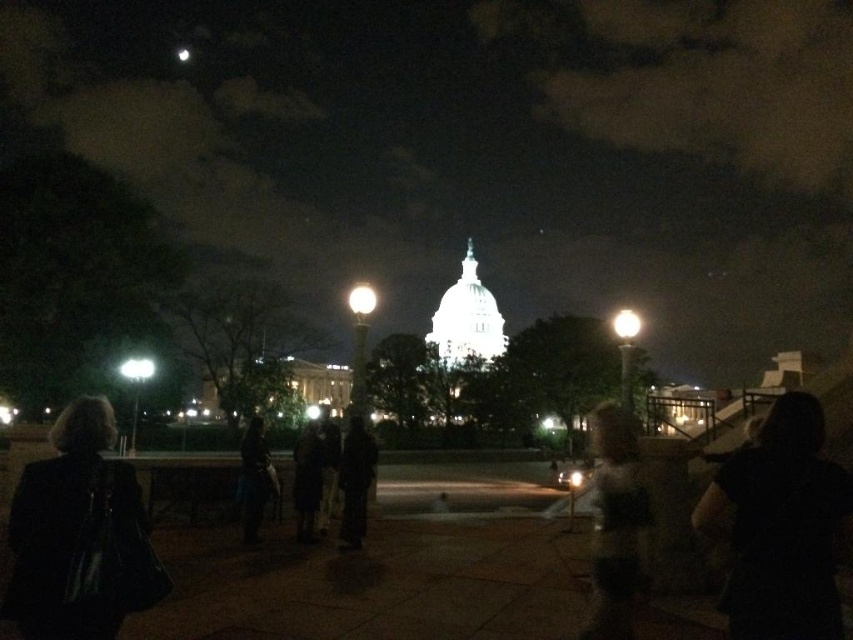
Question: Is dark gray leather jacket at lower left thinner than black fabric at center?

Choices:
 (A) no
 (B) yes

Answer: (A)

Question: Which of the following is the farthest from the observer?

Choices:
 (A) (78, 561)
 (B) (631, 502)
 (C) (769, 454)
 (D) (343, 531)

Answer: (D)

Question: From the image, what is the correct spatial relationship of black fabric at center in relation to dark gray hoodie at lower right?

Choices:
 (A) above
 (B) below

Answer: (A)

Question: Which of the following is the closest to the observer?

Choices:
 (A) (247, 541)
 (B) (358, 515)

Answer: (B)

Question: Which point appears closest to the camera in this image?

Choices:
 (A) (65, 637)
 (B) (618, 550)
 (C) (351, 540)
 (D) (758, 522)

Answer: (A)

Question: Observing the image, what is the correct spatial positioning of dark gray hoodie at lower right in reference to black fabric coat at center?

Choices:
 (A) below
 (B) above

Answer: (A)